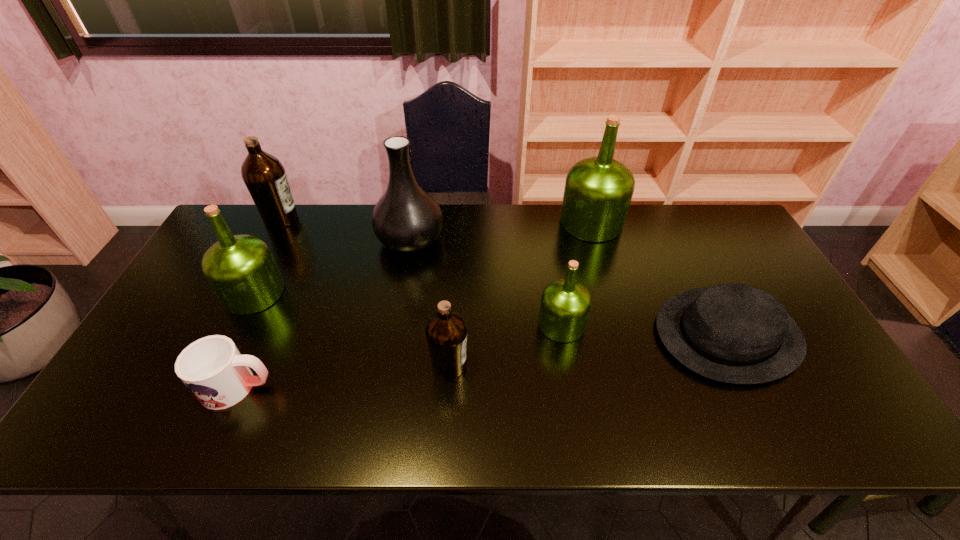
Choose which olive oil is the fourth nearest neighbor to the farthest green olive oil. Please provide its 2D coordinates. Your answer should be formatted as a tuple, i.e. [(x, y)], where the tuple contains the x and y coordinates of a point satisfying the conditions above.

[(264, 175)]

Locate an element on the screen. green olive oil that is the second closest to the vase is located at coordinates (565, 306).

In order to click on green olive oil that is the third closest one to the black fedora in this screenshot , I will do `click(241, 270)`.

Identify the location of vacant region that satisfies the following two spatial constraints: 1. on the label of the fedora; 2. on the right side of the bigger brown olive oil. This screenshot has width=960, height=540. (222, 334).

At what (x,y) coordinates should I click in order to perform the action: click on vacant area that satisfies the following two spatial constraints: 1. on the label of the smallest green olive oil; 2. on the left side of the farther brown olive oil. Please return your answer as a coordinate pair (x, y). This screenshot has height=540, width=960. Looking at the image, I should click on click(227, 324).

This screenshot has width=960, height=540. I want to click on free space that satisfies the following two spatial constraints: 1. on the label of the second smallest green olive oil; 2. on the left side of the left brown olive oil, so click(243, 293).